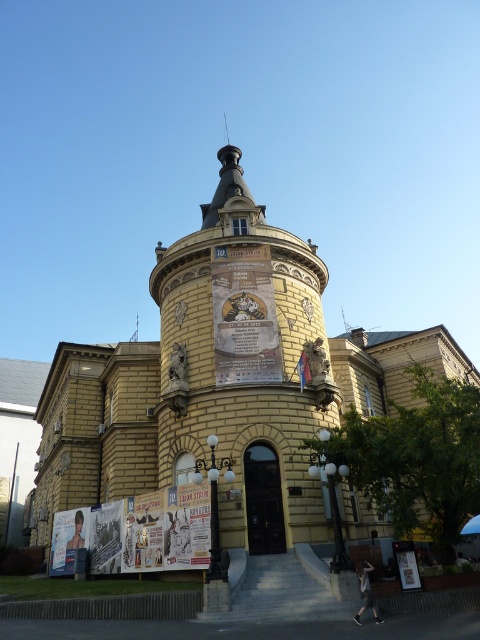
You are standing at the entrance of the historic building and see the white glossy posters at lower left and the yellow paper poster at center. Which poster is positioned to the left of the other?

The white glossy posters at lower left is to the left of yellow paper poster at center.

You are standing at the entrance of the yellow stone building at center and want to reach the white glossy posters at lower left. The path is clear, but you have a wheelchair with a maximum turning radius of 1.5 meters. Can you navigate to the posters without obstacles?

The distance between the yellow stone building at center and the white glossy posters at lower left is 12.86 meters. Since the path is clear and the wheelchair can move in straight lines and turns with a 1.5 meter radius, you can navigate to the posters without obstacles.